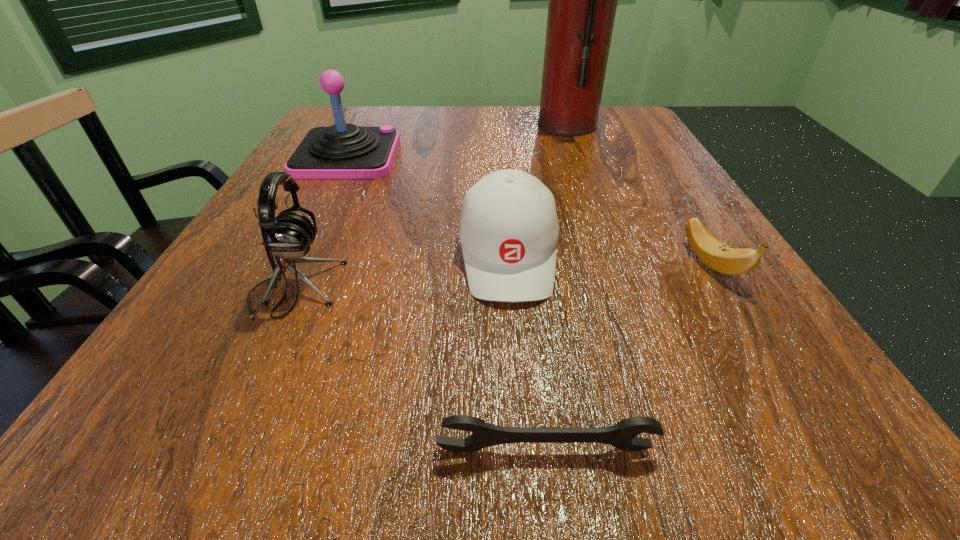
I want to click on the tallest object, so click(x=583, y=0).

This screenshot has width=960, height=540. I want to click on joystick, so click(342, 151).

I want to click on earphone, so click(x=288, y=236).

Find the location of a particular element. The image size is (960, 540). baseball cap is located at coordinates (509, 230).

Locate an element on the screen. The width and height of the screenshot is (960, 540). the rightmost object is located at coordinates (720, 257).

The width and height of the screenshot is (960, 540). In order to click on banana in this screenshot , I will do `click(720, 257)`.

Locate an element on the screen. This screenshot has height=540, width=960. the nearest object is located at coordinates 621,435.

The height and width of the screenshot is (540, 960). I want to click on the shortest object, so click(x=621, y=435).

Where is `free spot located at the nozzle of the fire extinguisher`? free spot located at the nozzle of the fire extinguisher is located at coordinates [413, 125].

The image size is (960, 540). What are the coordinates of `vacant position located 0.400m at the nozzle of the fire extinguisher` in the screenshot? It's located at (376, 125).